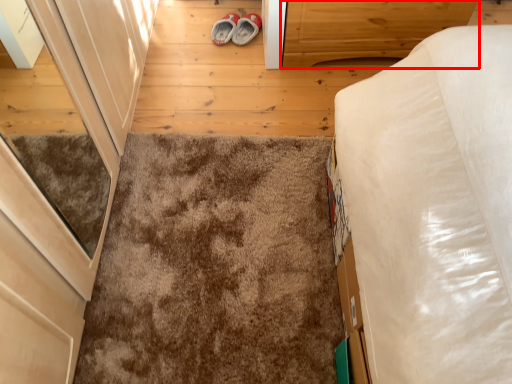
Question: Considering the relative positions of cabinetry (annotated by the red box) and mat in the image provided, where is cabinetry (annotated by the red box) located with respect to the staircase?

Choices:
 (A) right
 (B) left

Answer: (A)